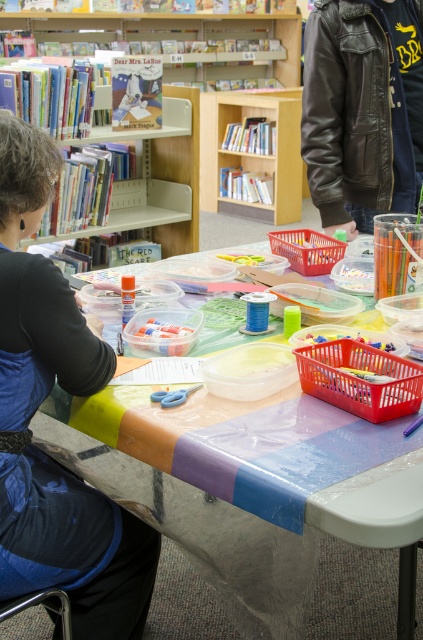
Question: Which is nearer to the leather jacket at upper right?

Choices:
 (A) wooden bookshelf at upper left
 (B) matte black shirt at left
 (C) light wood bookshelf at upper center
 (D) translucent plastic table at center

Answer: (B)

Question: Is translucent plastic table at center above wooden bookshelf at upper left?

Choices:
 (A) yes
 (B) no

Answer: (B)

Question: Which object appears closest to the camera in this image?

Choices:
 (A) leather jacket at upper right
 (B) light wood bookshelf at upper center
 (C) translucent plastic table at center
 (D) wooden bookshelf at upper left

Answer: (C)

Question: Does matte black shirt at left have a lesser width compared to light wood bookshelf at upper center?

Choices:
 (A) no
 (B) yes

Answer: (B)

Question: Which point is farther to the camera?

Choices:
 (A) wooden bookshelf at upper left
 (B) light wood bookshelf at upper center

Answer: (A)

Question: Where is translucent plastic table at center located in relation to leather jacket at upper right in the image?

Choices:
 (A) above
 (B) below

Answer: (B)